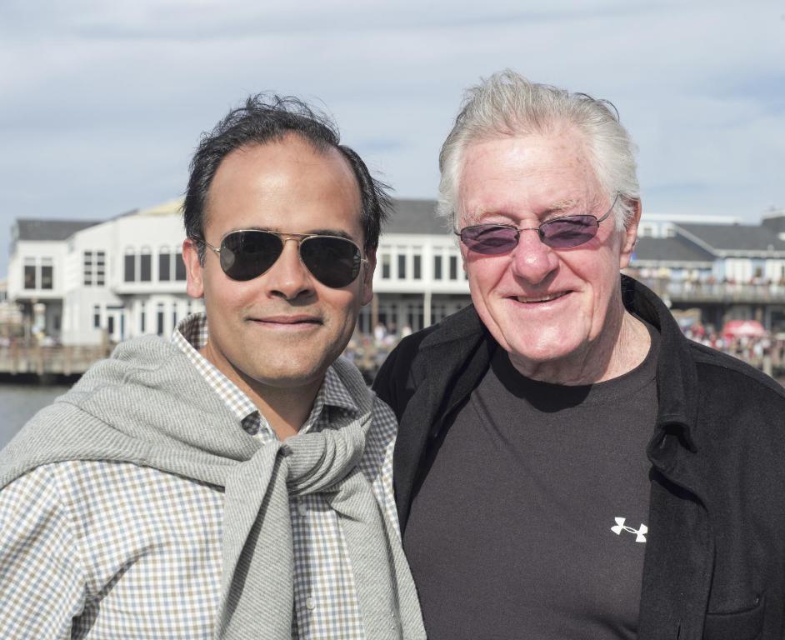
Is checkered fabric scarf at left shorter than gray wool scarf at left?

Incorrect, checkered fabric scarf at left's height does not fall short of gray wool scarf at left's.

Which is above, checkered fabric scarf at left or gray wool scarf at left?

checkered fabric scarf at left is above.

Which is behind, point (184, 260) or point (39, 397)?

The point (39, 397) is more distant.

This screenshot has height=640, width=785. What are the coordinates of `checkered fabric scarf at left` in the screenshot? It's located at (221, 435).

Locate an element on the screen. The image size is (785, 640). checkered fabric scarf at left is located at coordinates (221, 435).

Does point (243, 420) lie in front of point (513, 234)?

Yes.

Identify the location of checkered fabric scarf at left. (221, 435).

Between checkered fabric scarf at left and matte black sunglasses at center, which one is positioned lower?

matte black sunglasses at center

Is checkered fabric scarf at left further to camera compared to matte black sunglasses at center?

No.

Is point (157, 540) positioned after point (254, 236)?

No.

You are a GUI agent. You are given a task and a screenshot of the screen. Output one action in this format:
    pyautogui.click(x=<x>, y=<y>)
    Task: Click on the checkered fabric scarf at left
    Image resolution: width=785 pixels, height=640 pixels.
    Given the screenshot: What is the action you would take?
    pyautogui.click(x=221, y=435)